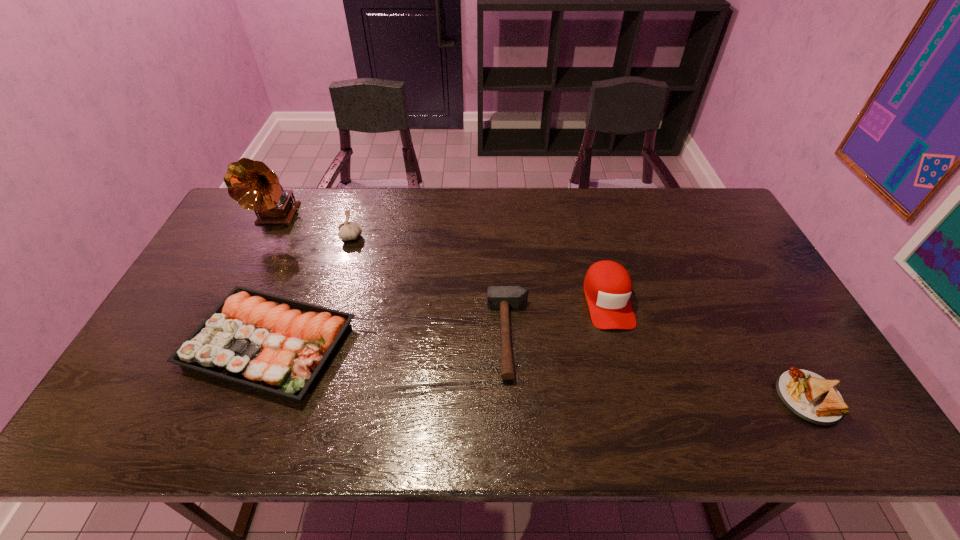
Image resolution: width=960 pixels, height=540 pixels. Find the location of `vacant area located 0.250m on the right of the platter`. vacant area located 0.250m on the right of the platter is located at coordinates (447, 345).

This screenshot has width=960, height=540. Find the location of `free spot located 0.300m on the striking surface of the fourth object from left to right`. free spot located 0.300m on the striking surface of the fourth object from left to right is located at coordinates (374, 336).

Locate an element on the screen. vacant area located on the striking surface of the fourth object from left to right is located at coordinates (404, 336).

Image resolution: width=960 pixels, height=540 pixels. Find the location of `vacant space located on the striking surface of the fourth object from left to right`. vacant space located on the striking surface of the fourth object from left to right is located at coordinates 443,336.

Where is `free space located 0.350m on the back of the sandwich`? The image size is (960, 540). free space located 0.350m on the back of the sandwich is located at coordinates (736, 271).

The height and width of the screenshot is (540, 960). I want to click on phonograph_record that is at the far edge, so click(252, 184).

Where is `garlic that is at the far edge`? garlic that is at the far edge is located at coordinates [x=348, y=230].

The height and width of the screenshot is (540, 960). What are the coordinates of `platter that is at the near edge` in the screenshot? It's located at (278, 345).

Where is `sandwich situated at the near edge`? The height and width of the screenshot is (540, 960). sandwich situated at the near edge is located at coordinates (809, 396).

At what (x,y) coordinates should I click in order to perform the action: click on phonograph_record positioned at the left edge. Please return your answer as a coordinate pair (x, y). The image size is (960, 540). Looking at the image, I should click on (252, 184).